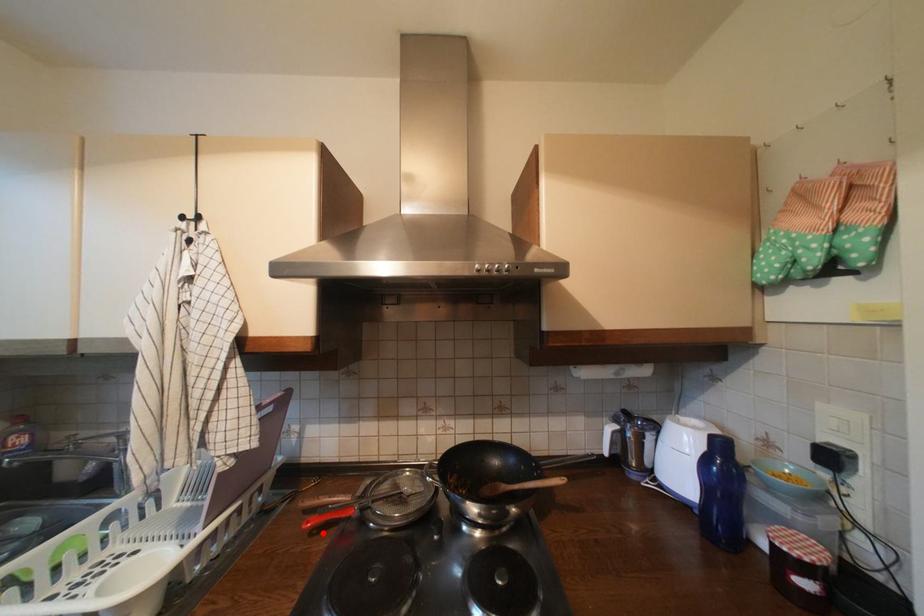
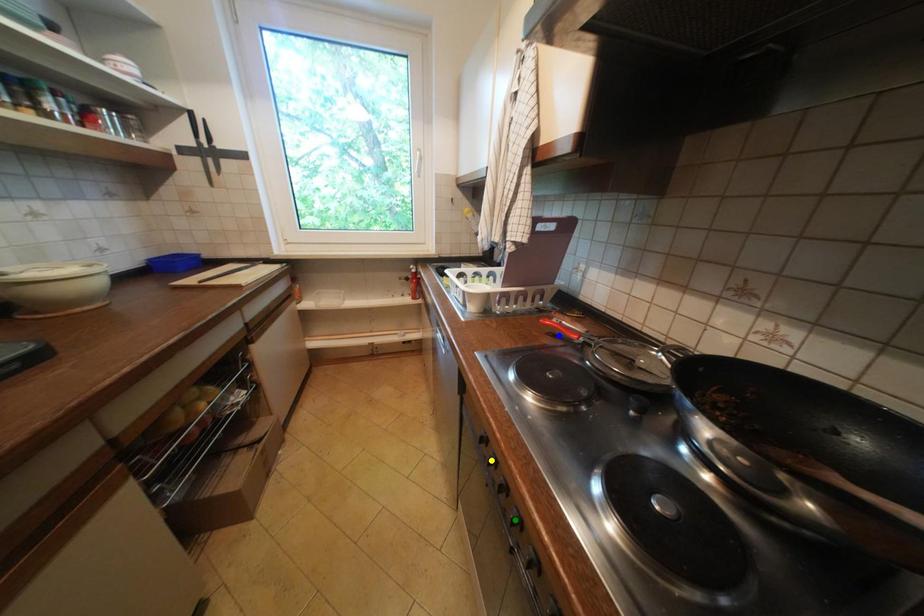
Question: I am providing you with two images of the same scene from different viewpoints. A red point is marked on the first image. You are given multiple points on the second image. Which spot in image 2 lines up with the point in image 1?

Choices:
 (A) green point
 (B) yellow point
 (C) blue point

Answer: (C)